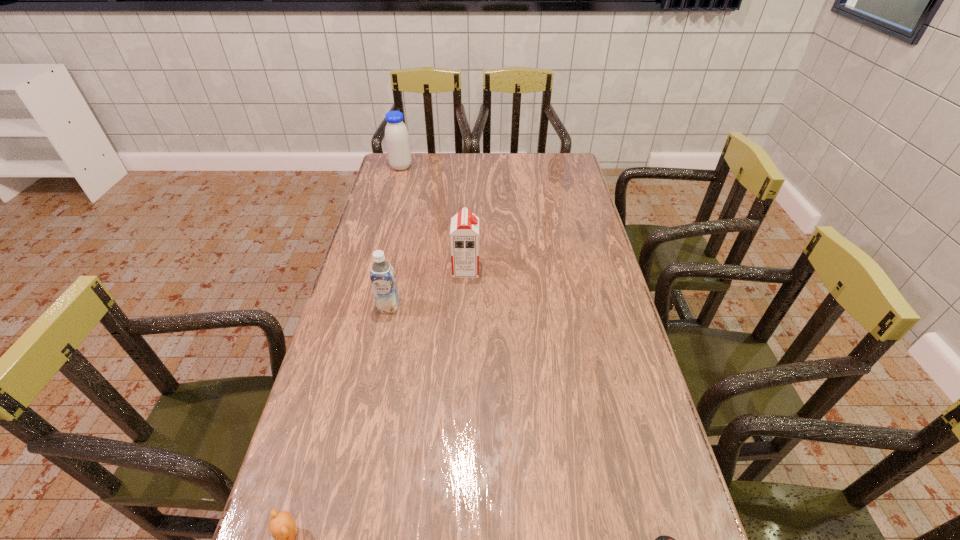
Identify which soya milk is the nearest to the control. Please provide its 2D coordinates. Your answer should be formatted as a tuple, i.e. [(x, y)], where the tuple contains the x and y coordinates of a point satisfying the conditions above.

[(382, 275)]